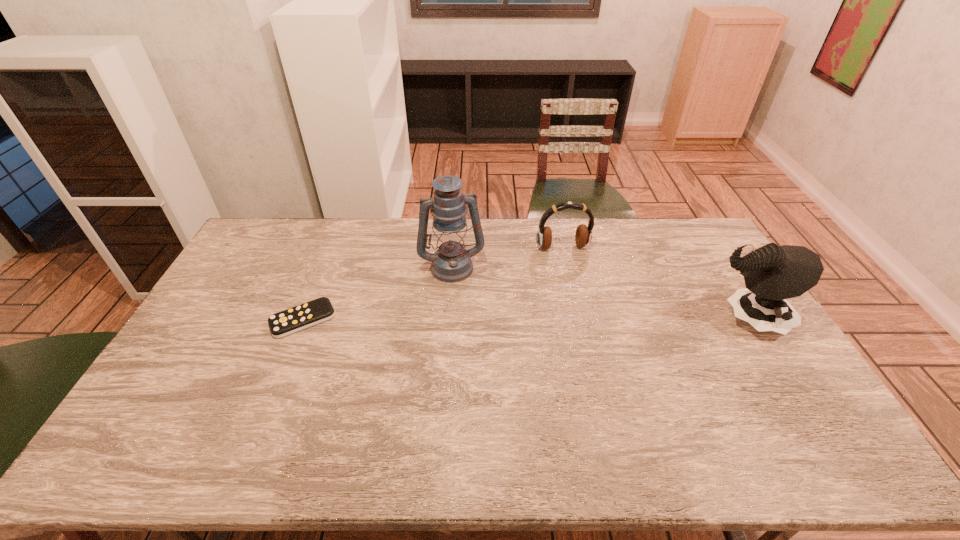
This screenshot has width=960, height=540. In order to click on empty location between the third shortest object and the third object from left to right in this screenshot , I will do `click(654, 284)`.

Where is `vacant area that lies between the remote control and the tallest object`? The image size is (960, 540). vacant area that lies between the remote control and the tallest object is located at coordinates (377, 293).

At what (x,y) coordinates should I click in order to perform the action: click on empty location between the third shortest object and the third object from right to left. Please return your answer as a coordinate pair (x, y). Looking at the image, I should click on (599, 293).

Identify which object is the second closest to the headset. Please provide its 2D coordinates. Your answer should be formatted as a tuple, i.e. [(x, y)], where the tuple contains the x and y coordinates of a point satisfying the conditions above.

[(772, 274)]

At what (x,y) coordinates should I click in order to perform the action: click on object that is the closest to the headset. Please return your answer as a coordinate pair (x, y). Looking at the image, I should click on (451, 262).

Where is `vacant space that satisfies the following two spatial constraints: 1. on the front side of the tallest object; 2. at the face of the doll`? The width and height of the screenshot is (960, 540). vacant space that satisfies the following two spatial constraints: 1. on the front side of the tallest object; 2. at the face of the doll is located at coordinates (448, 320).

The image size is (960, 540). I want to click on blank space that satisfies the following two spatial constraints: 1. on the front side of the rightmost object; 2. at the face of the remote control, so click(x=303, y=320).

At what (x,y) coordinates should I click in order to perform the action: click on vacant area that satisfies the following two spatial constraints: 1. on the back side of the second object from right to left; 2. on the right side of the tallest object. Please return your answer as a coordinate pair (x, y). The image size is (960, 540). Looking at the image, I should click on (453, 247).

Identify the location of free spot that satisfies the following two spatial constraints: 1. on the front side of the third object from right to left; 2. at the face of the doll. The height and width of the screenshot is (540, 960). (448, 320).

This screenshot has width=960, height=540. I want to click on vacant space that satisfies the following two spatial constraints: 1. on the front side of the third object from left to right; 2. at the face of the doll, so click(x=579, y=320).